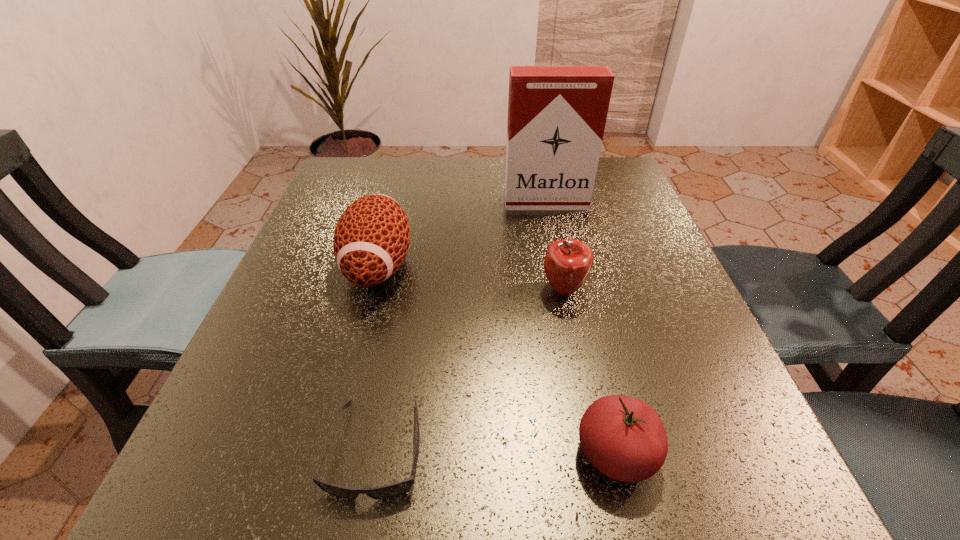
At what (x,y) coordinates should I click in order to perform the action: click on free space between the sunglasses and the tallest object. Please return your answer as a coordinate pair (x, y). This screenshot has width=960, height=540. Looking at the image, I should click on (461, 326).

This screenshot has width=960, height=540. In order to click on object identified as the second closest to the football in this screenshot , I will do `click(557, 115)`.

Find the location of a particular element. This screenshot has width=960, height=540. the closest object to the cigarette_case is located at coordinates (371, 239).

Locate an element on the screen. This screenshot has width=960, height=540. free space that satisfies the following two spatial constraints: 1. on the front side of the football; 2. on the left side of the apple is located at coordinates (372, 291).

Where is `vacant space that satisfies the following two spatial constraints: 1. on the front-facing side of the cigarette_case; 2. on the left side of the apple`? vacant space that satisfies the following two spatial constraints: 1. on the front-facing side of the cigarette_case; 2. on the left side of the apple is located at coordinates (564, 291).

Where is `vacant position in the image that satisfies the following two spatial constraints: 1. on the front-facing side of the tallest object; 2. on the left side of the apple`? This screenshot has height=540, width=960. vacant position in the image that satisfies the following two spatial constraints: 1. on the front-facing side of the tallest object; 2. on the left side of the apple is located at coordinates (564, 291).

What are the coordinates of `free point that satisfies the following two spatial constraints: 1. on the front-facing side of the tomato; 2. on the left side of the tallest object` in the screenshot? It's located at coord(597,453).